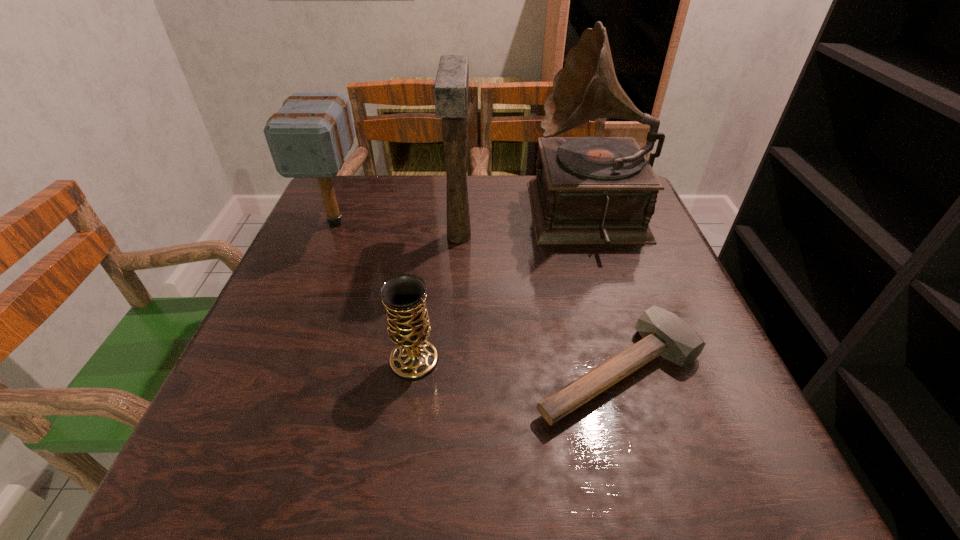
The width and height of the screenshot is (960, 540). Find the location of `record player`. record player is located at coordinates (588, 190).

You are a GUI agent. You are given a task and a screenshot of the screen. Output one action in this format:
    pyautogui.click(x=<x>, y=<y>)
    Task: Click on the second mallet from left to right
    
    Given the screenshot: What is the action you would take?
    pyautogui.click(x=451, y=86)

Locate an element on the screen. The image size is (960, 540). the leftmost object is located at coordinates (309, 137).

This screenshot has width=960, height=540. What are the coordinates of `the third tallest object` in the screenshot? It's located at (309, 137).

Image resolution: width=960 pixels, height=540 pixels. Identify the location of chalice. (404, 296).

You are a GUI agent. You are given a task and a screenshot of the screen. Output one action in this format:
    pyautogui.click(x=<x>, y=<y>)
    Task: Click on the rightmost mallet
    
    Given the screenshot: What is the action you would take?
    pyautogui.click(x=664, y=333)

Where is `the shortest object`? Image resolution: width=960 pixels, height=540 pixels. the shortest object is located at coordinates (664, 333).

Locate an element on the screen. vacant region located 0.250m from the horn of the record player is located at coordinates (432, 218).

The image size is (960, 540). What are the coordinates of `vacant space located from the horn of the record player` in the screenshot? It's located at (492, 218).

Where is `vacant region located from the horn of the record player`? The width and height of the screenshot is (960, 540). vacant region located from the horn of the record player is located at coordinates (408, 218).